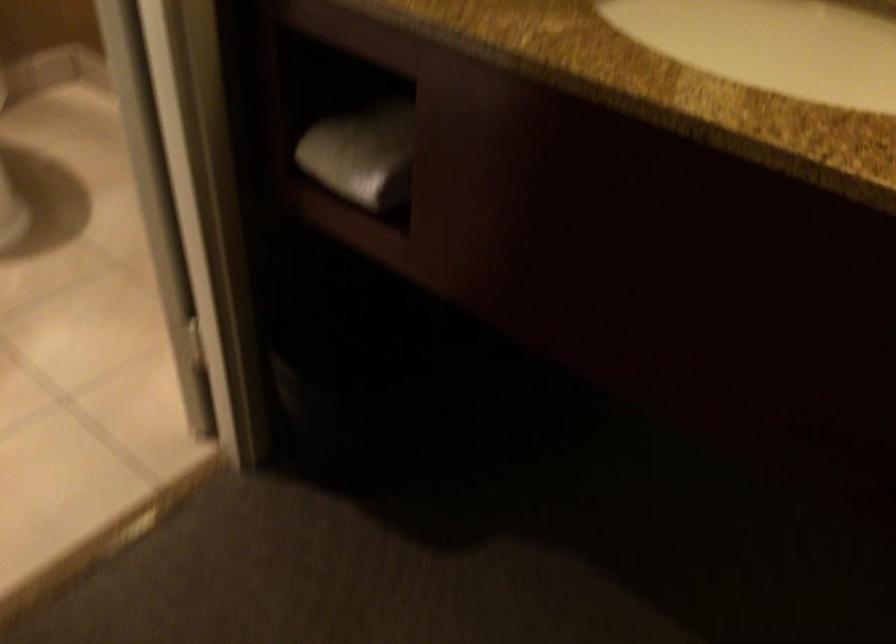
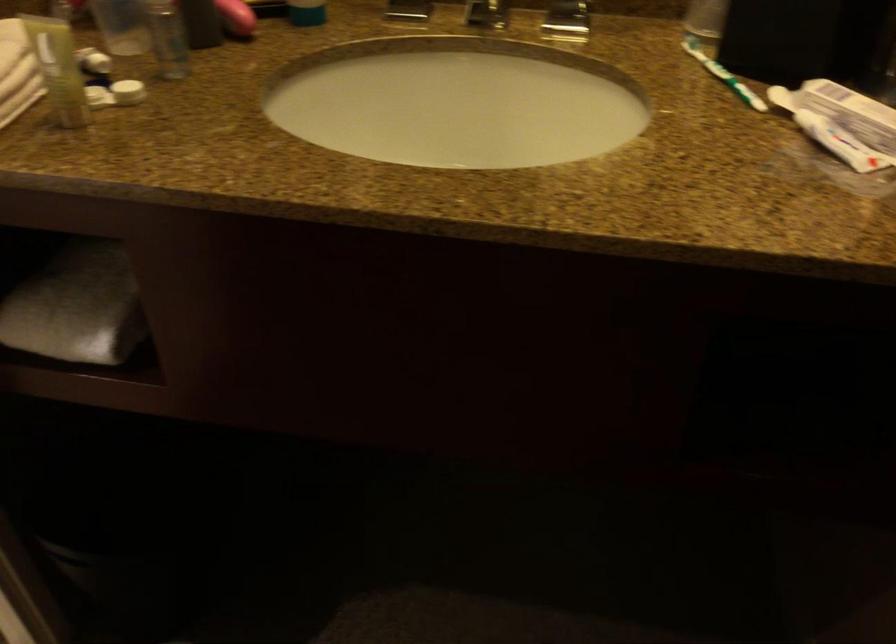
Find the pixel in the second image that matches the point at 366,151 in the first image.

(76, 306)